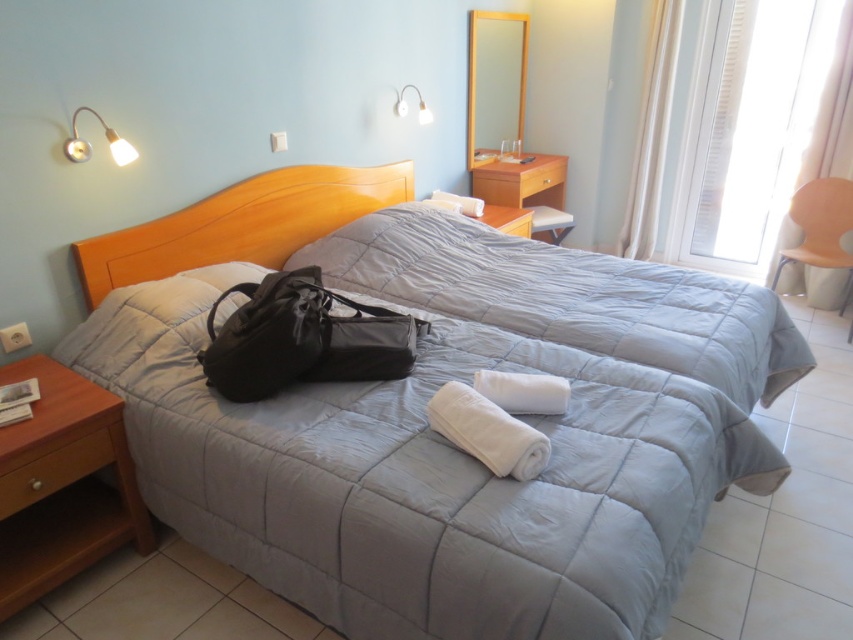
Question: Does matte gray quilted bed at center have a greater width compared to black leather bag at center?

Choices:
 (A) yes
 (B) no

Answer: (A)

Question: Which point is farther to the camera?

Choices:
 (A) (680, 342)
 (B) (463, 566)

Answer: (A)

Question: In this image, where is gray quilted blanket at center located relative to black leather bag at center?

Choices:
 (A) above
 (B) below

Answer: (A)

Question: Which point is farther to the camera?

Choices:
 (A) white fabric lampshade at upper center
 (B) matte metal lamp at upper left
 (C) matte gray quilted bed at center
 (D) black leather bag at center

Answer: (A)

Question: Which object is positioned closest to the white fabric lampshade at upper center?

Choices:
 (A) matte metal lamp at upper left
 (B) gray quilted blanket at center
 (C) matte gray quilted bed at center
 (D) black leather bag at center

Answer: (B)

Question: Is matte metal lamp at upper left in front of white fabric lampshade at upper center?

Choices:
 (A) yes
 (B) no

Answer: (A)